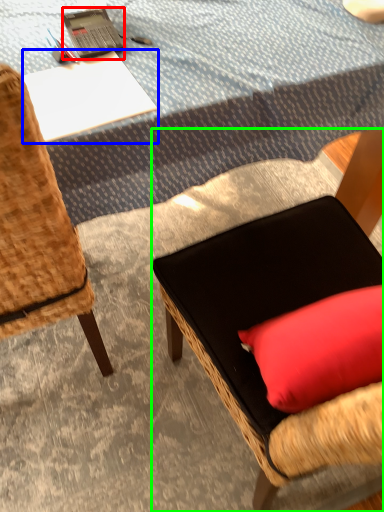
Question: Estimate the real-world distances between objects in this image. Which object is closer to laptop (highlighted by a red box), desk (highlighted by a blue box) or chair (highlighted by a green box)?

Choices:
 (A) desk
 (B) chair

Answer: (A)